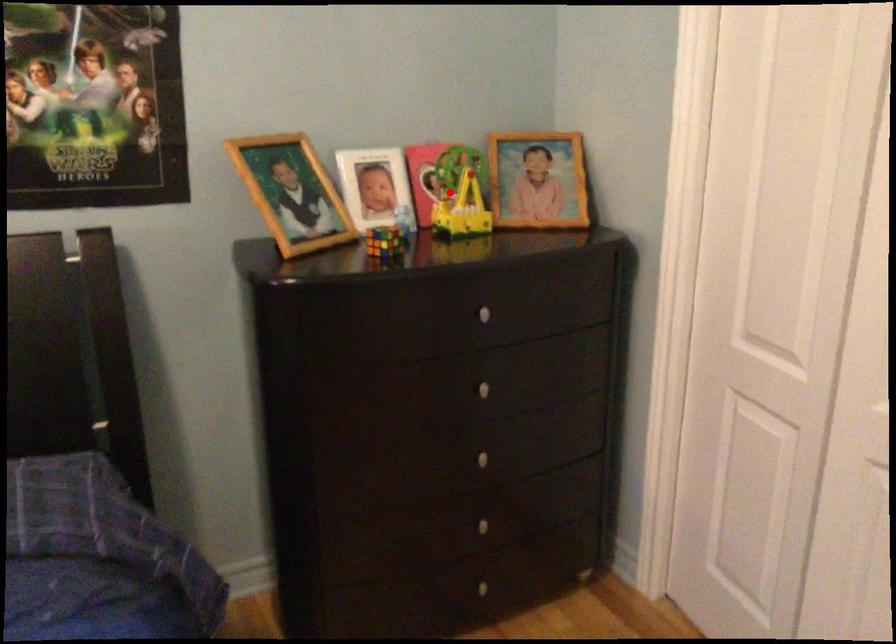
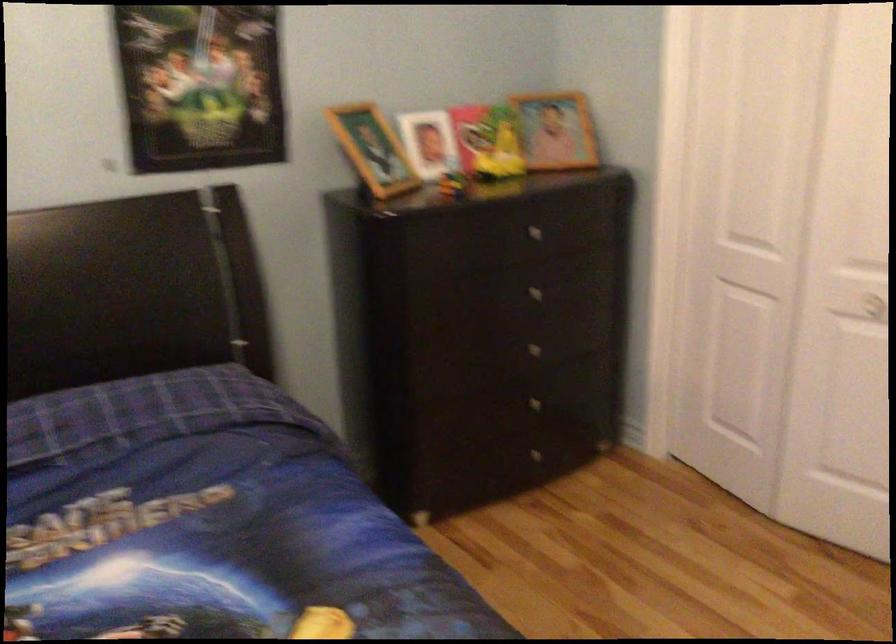
The point at the highlighted location is marked in the first image. Where is the corresponding point in the second image?

(487, 142)